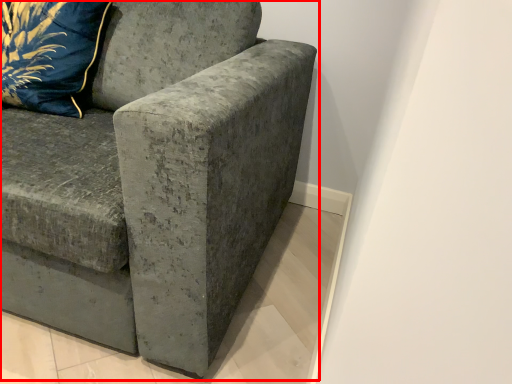
Question: From the image's perspective, where is studio couch (annotated by the red box) located in relation to pillow in the image?

Choices:
 (A) below
 (B) above

Answer: (A)